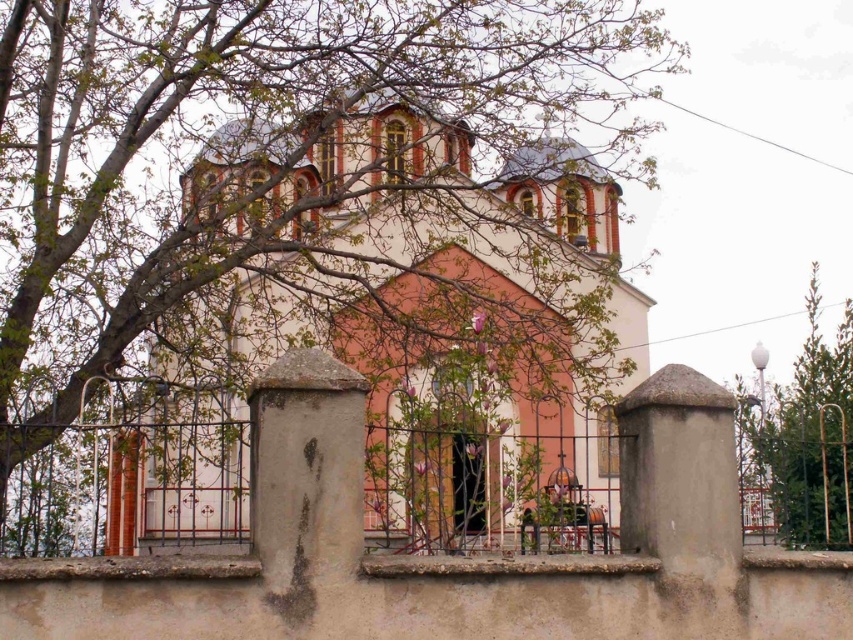
You are standing at the entrance of the traditional Eastern Orthodox church and want to touch the bare branches at upper left. Given that you can only reach up to 2 meters, can you reach them without any assistance?

The bare branches at upper left are 39.02 meters away from the viewer, so you cannot reach them without assistance.

You are standing in front of the church and notice two trees. One is the bare branches at upper left and the other is the green leafy tree at right. Which tree is positioned more to the left side of the scene?

The bare branches at upper left are positioned more to the left side of the scene compared to the green leafy tree at right.

You are standing in front of the church and notice two trees in the image. One is the bare branches at upper left and the other is the green leafy tree at right. Which tree appears bigger in the scene?

The bare branches at upper left appears larger in size than the green leafy tree at right.